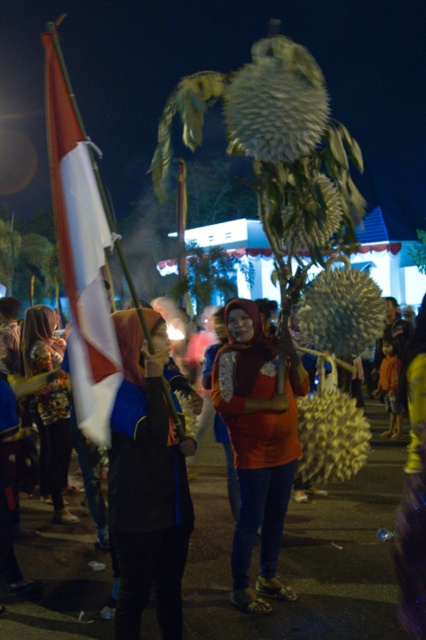
Question: Is the position of dark blue fabric jacket at center less distant than that of printed fabric hijab at left?

Choices:
 (A) yes
 (B) no

Answer: (A)

Question: Does matte orange hijab at center appear on the left side of dark blue fabric jacket at center?

Choices:
 (A) yes
 (B) no

Answer: (B)

Question: Which is farther from the printed fabric hijab at left?

Choices:
 (A) matte orange shirt at center
 (B) red-white striped flag at left
 (C) dark blue fabric jacket at center

Answer: (C)

Question: Is dark blue fabric jacket at center further to camera compared to printed fabric hijab at left?

Choices:
 (A) no
 (B) yes

Answer: (A)

Question: Which point is closer to the camera?

Choices:
 (A) matte orange shirt at center
 (B) matte orange hijab at center
 (C) dark blue fabric jacket at center
 (D) printed fabric hijab at left

Answer: (C)

Question: Among these objects, which one is farthest from the camera?

Choices:
 (A) red-white striped flag at left
 (B) matte orange hijab at center

Answer: (B)